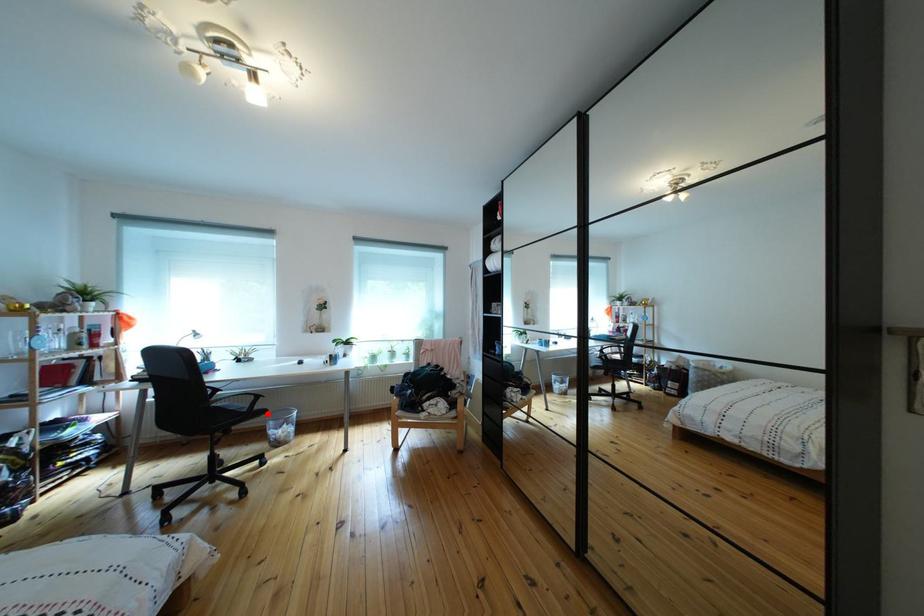
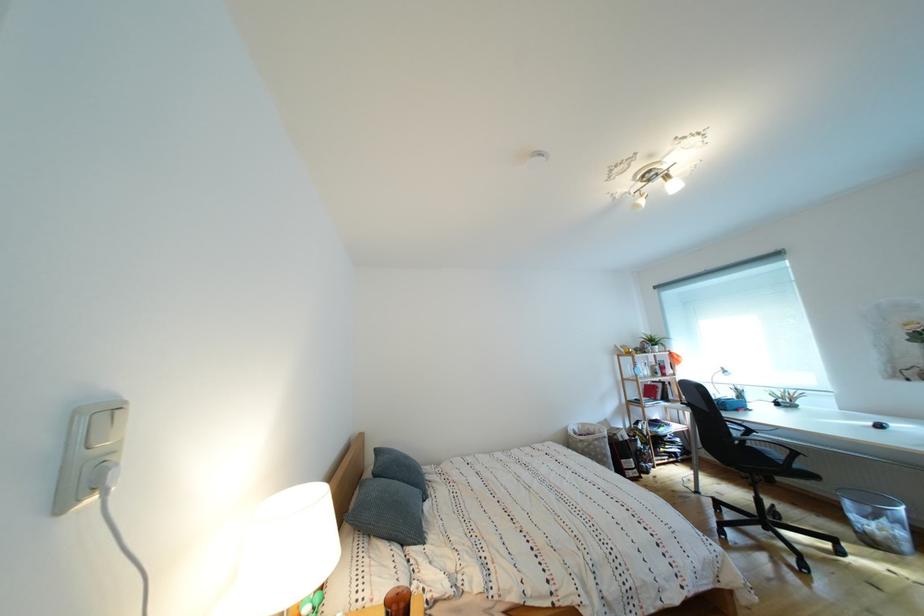
Find the pixel in the second image that matches the highlighted location in the first image.

(808, 472)